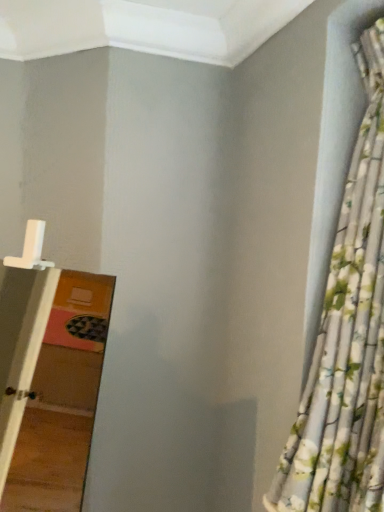
Question: Considering the positions of point (281, 479) and point (67, 438), is point (281, 479) closer or farther from the camera than point (67, 438)?

Choices:
 (A) closer
 (B) farther

Answer: (A)

Question: From the image's perspective, is floral fabric curtain at right above or below white plastic ladder at left?

Choices:
 (A) below
 (B) above

Answer: (B)

Question: Considering the positions of floral fabric curtain at right and white plastic ladder at left in the image, is floral fabric curtain at right bigger or smaller than white plastic ladder at left?

Choices:
 (A) big
 (B) small

Answer: (B)

Question: From the image's perspective, relative to floral fabric curtain at right, is white plastic ladder at left above or below?

Choices:
 (A) above
 (B) below

Answer: (B)

Question: Is white plastic ladder at left in front of or behind floral fabric curtain at right in the image?

Choices:
 (A) behind
 (B) front

Answer: (B)

Question: Does point (8, 330) appear closer or farther from the camera than point (283, 509)?

Choices:
 (A) closer
 (B) farther

Answer: (B)

Question: Is white plastic ladder at left wider or thinner than floral fabric curtain at right?

Choices:
 (A) wide
 (B) thin

Answer: (A)